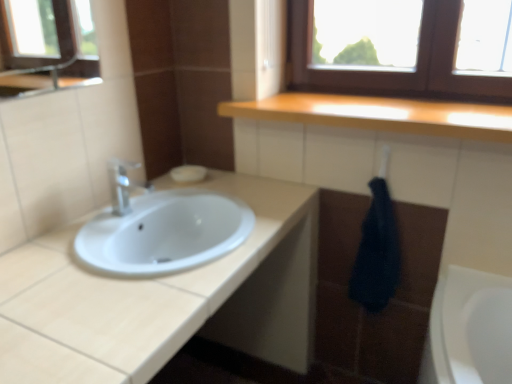
The width and height of the screenshot is (512, 384). Describe the element at coordinates (377, 253) in the screenshot. I see `dark blue towel at lower right` at that location.

The image size is (512, 384). I want to click on white matte soap at center, so click(188, 173).

The image size is (512, 384). What do you see at coordinates (121, 185) in the screenshot? I see `satin nickel faucet at left` at bounding box center [121, 185].

At what (x,y) coordinates should I click in order to perform the action: click on dark blue towel at lower right. Please return your answer as a coordinate pair (x, y). Image resolution: width=512 pixels, height=384 pixels. Looking at the image, I should click on (377, 253).

In the scene shown: Between white matte soap at center and wooden countertop at upper center, which one is positioned in front?

wooden countertop at upper center is closer to the camera.

Which object is thinner, white matte soap at center or wooden countertop at upper center?

white matte soap at center.

This screenshot has width=512, height=384. Find the location of `soap on the left of wooden countertop at upper center`. soap on the left of wooden countertop at upper center is located at coordinates (188, 173).

From the image's perspective, would you say white matte soap at center is shown under wooden countertop at upper center?

Correct, white matte soap at center appears lower than wooden countertop at upper center in the image.

Looking at this image, is satin nickel faucet at left at the right side of white glossy sink at center?

No.

Between satin nickel faucet at left and white glossy sink at center, which one is positioned behind?

satin nickel faucet at left is behind.

Is satin nickel faucet at left positioned with its back to white glossy sink at center?

No, satin nickel faucet at left is not facing away from white glossy sink at center.

Between wooden countertop at upper center and satin nickel faucet at left, which one appears on the left side from the viewer's perspective?

From the viewer's perspective, satin nickel faucet at left appears more on the left side.

Which object is further away from the camera, wooden countertop at upper center or satin nickel faucet at left?

satin nickel faucet at left is further away from the camera.

Which of these two, wooden countertop at upper center or satin nickel faucet at left, is wider?

wooden countertop at upper center is wider.

Is white matte soap at center spatially inside white glossy sink at center, or outside of it?

white matte soap at center is spatially situated outside white glossy sink at center.

Who is bigger, white matte soap at center or white glossy sink at center?

With larger size is white glossy sink at center.

Is point (199, 174) behind point (33, 254)?

Yes, it is.

In the scene shown: Measure the distance between satin nickel faucet at left and wooden countertop at upper center.

satin nickel faucet at left and wooden countertop at upper center are 29.58 inches apart from each other.

Looking at this image, is satin nickel faucet at left not inside wooden countertop at upper center?

Yes, satin nickel faucet at left is located beyond the bounds of wooden countertop at upper center.

Does point (113, 167) come in front of point (231, 108)?

Yes, point (113, 167) is closer to viewer.

Between satin nickel faucet at left and wooden countertop at upper center, which one has larger width?

With larger width is wooden countertop at upper center.

From a real-world perspective, is white glossy sink at center physically located above or below satin nickel faucet at left?

Clearly, from a real-world perspective, white glossy sink at center is below satin nickel faucet at left.

Is white glossy sink at center positioned far away from satin nickel faucet at left?

That's not correct — white glossy sink at center is a little close to satin nickel faucet at left.

Is white glossy sink at center looking in the opposite direction of satin nickel faucet at left?

No, white glossy sink at center is not facing the opposite direction of satin nickel faucet at left.

Would you say white glossy sink at center is to the left or to the right of satin nickel faucet at left in the picture?

white glossy sink at center is to the right of satin nickel faucet at left.

From a real-world perspective, is white glossy sink at center located higher than white matte soap at center?

No, from a real-world perspective, white glossy sink at center is not above white matte soap at center.

Is white glossy sink at center aimed at white matte soap at center?

No, white glossy sink at center is not oriented towards white matte soap at center.

From the picture: From the image's perspective, is white glossy sink at center beneath white matte soap at center?

Yes, from the image's perspective, white glossy sink at center is beneath white matte soap at center.

Identify the location of soap behind the wooden countertop at upper center. The height and width of the screenshot is (384, 512). (188, 173).

Where is `bathroom cabinet located underneath the satin nickel faucet at left (from a real-world perspective)`? bathroom cabinet located underneath the satin nickel faucet at left (from a real-world perspective) is located at coordinates (164, 297).

From the picture: Looking at the image, which one is located further to white matte soap at center, wooden countertop at upper center or satin nickel faucet at left?

Based on the image, wooden countertop at upper center appears to be further to white matte soap at center.

Looking at the image, which one is located further to wooden countertop at upper center, white glossy sink at center or white matte soap at center?

Based on the image, white matte soap at center appears to be further to wooden countertop at upper center.

Looking at the image, which one is located closer to satin nickel faucet at left, white matte soap at center or white glossy sink at center?

Based on the image, white matte soap at center appears to be nearer to satin nickel faucet at left.

When comparing their distances from wooden countertop at upper center, does white matte soap at center or white glossy sink at center seem further?

white matte soap at center lies further to wooden countertop at upper center than the other object.

Considering their positions, is white glossy sink at center positioned further to satin nickel faucet at left than dark blue towel at lower right?

dark blue towel at lower right.

Considering their positions, is satin nickel faucet at left positioned further to wooden countertop at upper center than white matte soap at center?

satin nickel faucet at left.

Looking at the image, which one is located further to satin nickel faucet at left, dark blue towel at lower right or white matte soap at center?

Based on the image, dark blue towel at lower right appears to be further to satin nickel faucet at left.

Based on their spatial positions, is satin nickel faucet at left or wooden countertop at upper center closer to white matte soap at center?

The object closer to white matte soap at center is satin nickel faucet at left.

Find the location of a particular element. The image size is (512, 384). countertop between white glossy sink at center and dark blue towel at lower right is located at coordinates point(381,115).

Find the location of `soap between satin nickel faucet at left and dark blue towel at lower right`. soap between satin nickel faucet at left and dark blue towel at lower right is located at coordinates (188, 173).

Locate an element on the screen. Image resolution: width=512 pixels, height=384 pixels. tap between white glossy sink at center and white matte soap at center along the z-axis is located at coordinates (121, 185).

Locate an element on the screen. bathroom cabinet between satin nickel faucet at left and dark blue towel at lower right from left to right is located at coordinates (164, 297).